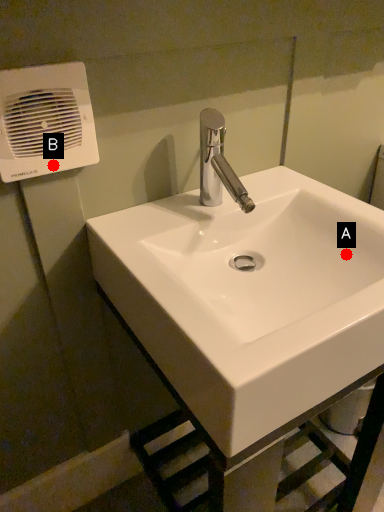
Question: Two points are circled on the image, labeled by A and B beside each circle. Which point is closer to the camera?

Choices:
 (A) A is closer
 (B) B is closer

Answer: (B)